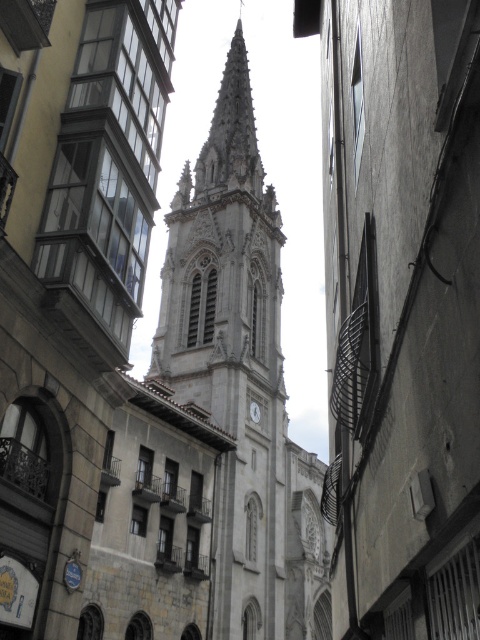
Question: Can you confirm if white stone tower at center is smaller than white glossy clock at center?

Choices:
 (A) no
 (B) yes

Answer: (A)

Question: Does white stone tower at center have a lesser width compared to white glossy clock at center?

Choices:
 (A) yes
 (B) no

Answer: (B)

Question: Which of the following is the farthest from the observer?

Choices:
 (A) (260, 410)
 (B) (228, 316)

Answer: (B)

Question: Which point is farther to the camera?

Choices:
 (A) (250, 404)
 (B) (214, 225)

Answer: (B)

Question: Is white stone tower at center to the left of white glossy clock at center from the viewer's perspective?

Choices:
 (A) no
 (B) yes

Answer: (B)